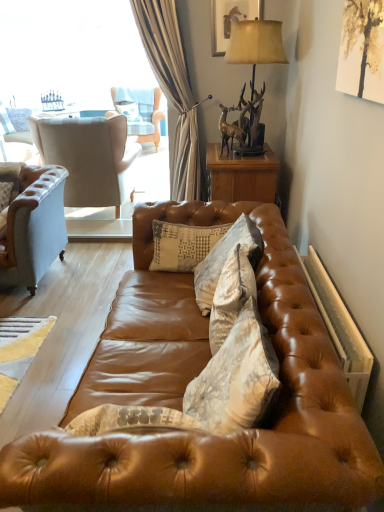
Question: In which direction should I rotate to look at white textured pillow at center, the 1th pillow viewed from the back?

Choices:
 (A) right
 (B) left

Answer: (B)

Question: From a real-world perspective, is wooden picture frame at upper center positioned under light beige fabric wingback chair at left, arranged as the 2th chair when viewed from the top, based on gravity?

Choices:
 (A) yes
 (B) no

Answer: (B)

Question: Is the position of wooden picture frame at upper center less distant than that of light beige fabric wingback chair at left, which appears as the first chair when ordered from the bottom?

Choices:
 (A) yes
 (B) no

Answer: (A)

Question: Is wooden picture frame at upper center far away from light beige fabric wingback chair at left, arranged as the 2th chair when viewed from the top?

Choices:
 (A) yes
 (B) no

Answer: (A)

Question: Is wooden picture frame at upper center smaller than light beige fabric wingback chair at left, the first chair viewed from the front?

Choices:
 (A) no
 (B) yes

Answer: (B)

Question: Can you confirm if wooden picture frame at upper center is bigger than light beige fabric wingback chair at left, positioned as the second chair in back-to-front order?

Choices:
 (A) yes
 (B) no

Answer: (B)

Question: Considering the relative positions of wooden picture frame at upper center and light beige fabric wingback chair at left, positioned as the second chair in back-to-front order, in the image provided, is wooden picture frame at upper center to the left of light beige fabric wingback chair at left, positioned as the second chair in back-to-front order, from the viewer's perspective?

Choices:
 (A) yes
 (B) no

Answer: (B)

Question: Is textured beige pillow at center, which is counted as the 1th pillow, starting from the bottom, further to the viewer compared to metallic gold deer at upper right?

Choices:
 (A) yes
 (B) no

Answer: (B)

Question: Is textured beige pillow at center, marked as the 3th pillow in a back-to-front arrangement, far away from metallic gold deer at upper right?

Choices:
 (A) no
 (B) yes

Answer: (B)

Question: Does textured beige pillow at center, the first pillow from the front, have a lesser height compared to metallic gold deer at upper right?

Choices:
 (A) no
 (B) yes

Answer: (A)

Question: Is textured beige pillow at center, the 3th pillow viewed from the left, taller than metallic gold deer at upper right?

Choices:
 (A) yes
 (B) no

Answer: (A)

Question: Is textured beige pillow at center, positioned as the 3th pillow in top-to-bottom order, thinner than metallic gold deer at upper right?

Choices:
 (A) no
 (B) yes

Answer: (A)

Question: Is textured beige pillow at center, which is counted as the 1th pillow, starting from the bottom, turned away from metallic gold deer at upper right?

Choices:
 (A) yes
 (B) no

Answer: (B)

Question: Considering the relative sizes of metallic gold deer at upper right and shiny brown leather couch at center in the image provided, is metallic gold deer at upper right wider than shiny brown leather couch at center?

Choices:
 (A) yes
 (B) no

Answer: (B)